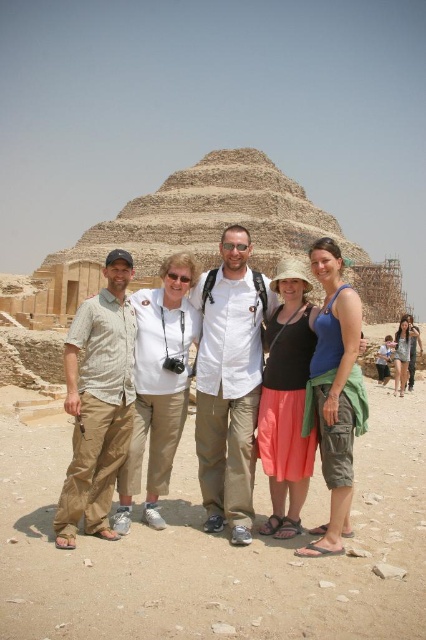
What do you see at coordinates (334, 394) in the screenshot? I see `blue cotton tank top at center` at bounding box center [334, 394].

Is blue cotton tank top at center shorter than matte khaki pants at center?

Indeed, blue cotton tank top at center has a lesser height compared to matte khaki pants at center.

Who is more forward, (337, 464) or (238, 260)?

Point (337, 464)

I want to click on blue cotton tank top at center, so click(x=334, y=394).

Does point (169, 365) come farther from viewer compared to point (331, 500)?

Yes, point (169, 365) is farther from viewer.

Between point (135, 305) and point (316, 545), which one is positioned in front?

Positioned in front is point (316, 545).

You are a GUI agent. You are given a task and a screenshot of the screen. Output one action in this format:
    pyautogui.click(x=<x>, y=<y>)
    Task: Click on the khaki pants at center
    
    Given the screenshot: What is the action you would take?
    pyautogui.click(x=158, y=387)

Is khaki pants at center thinner than matte khaki pants at center?

Correct, khaki pants at center's width is less than matte khaki pants at center's.

In order to click on khaki pants at center in this screenshot , I will do `click(158, 387)`.

Locate an element on the screen. khaki pants at center is located at coordinates (158, 387).